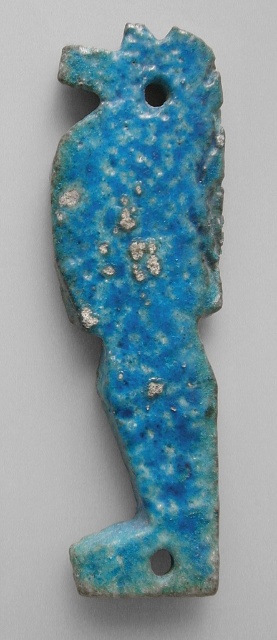
Question: Based on their relative distances, which object is nearer to the blue speckled stone hole at center?

Choices:
 (A) blue speckled stone fish at center
 (B) smooth blue hole at upper center

Answer: (A)

Question: Does blue speckled stone fish at center lie behind smooth blue hole at upper center?

Choices:
 (A) yes
 (B) no

Answer: (B)

Question: Which point is closer to the camera?

Choices:
 (A) (168, 560)
 (B) (147, 97)
 (C) (191, 243)

Answer: (A)

Question: Which of the following is the farthest from the observer?

Choices:
 (A) smooth blue hole at upper center
 (B) blue speckled stone fish at center
 (C) blue speckled stone hole at center

Answer: (A)

Question: In this image, where is smooth blue hole at upper center located relative to blue speckled stone hole at center?

Choices:
 (A) right
 (B) left

Answer: (B)

Question: Does smooth blue hole at upper center appear over blue speckled stone hole at center?

Choices:
 (A) no
 (B) yes

Answer: (B)